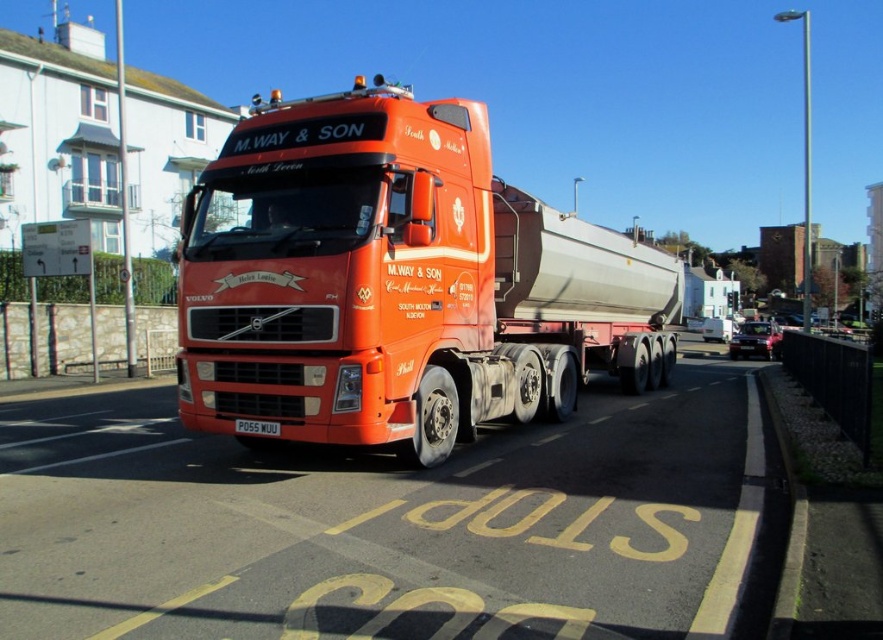
You are a traffic officer observing a matte orange truck at center and a white plastic license plate at center. According to the road rules, the license plate must be visible at all times. Is the license plate positioned correctly relative to the truck?

The matte orange truck at center is to the left of the white plastic license plate at center, so the license plate is positioned to the right side of the truck, which is the correct placement for visibility.

You are a traffic officer observing the matte orange truck at center. According to the road markings, where exactly is the truck positioned relative to the STOP area?

The matte orange truck at center is located at point (398, 282), which is within the STOP area marked on the road.